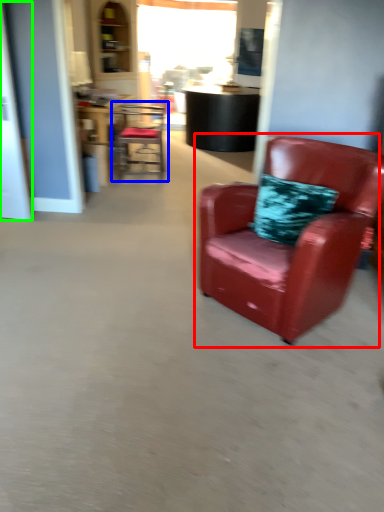
Question: Considering the real-world distances, which object is closest to chair (highlighted by a red box)? chair (highlighted by a blue box) or glass door (highlighted by a green box).

Choices:
 (A) chair
 (B) glass door

Answer: (B)